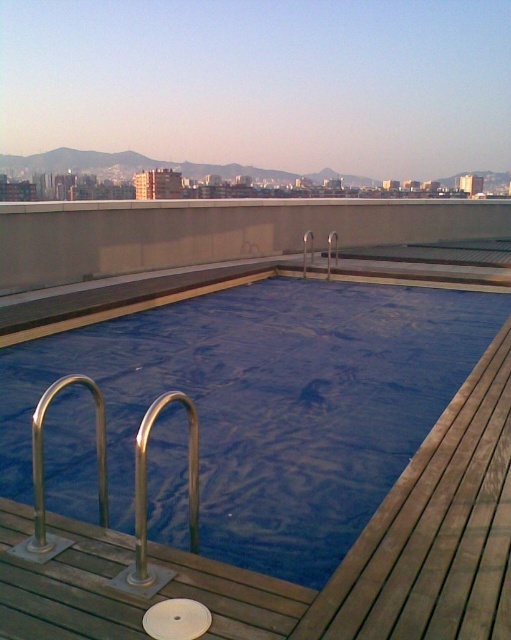
Which is above, blue rubber pool at center or silver metallic rail at center?

silver metallic rail at center is higher up.

Between point (184, 353) and point (143, 467), which one is positioned in front?

Point (143, 467) is more forward.

Locate an element on the screen. blue rubber pool at center is located at coordinates (267, 404).

Where is `blue rubber pool at center`? The image size is (511, 640). blue rubber pool at center is located at coordinates (267, 404).